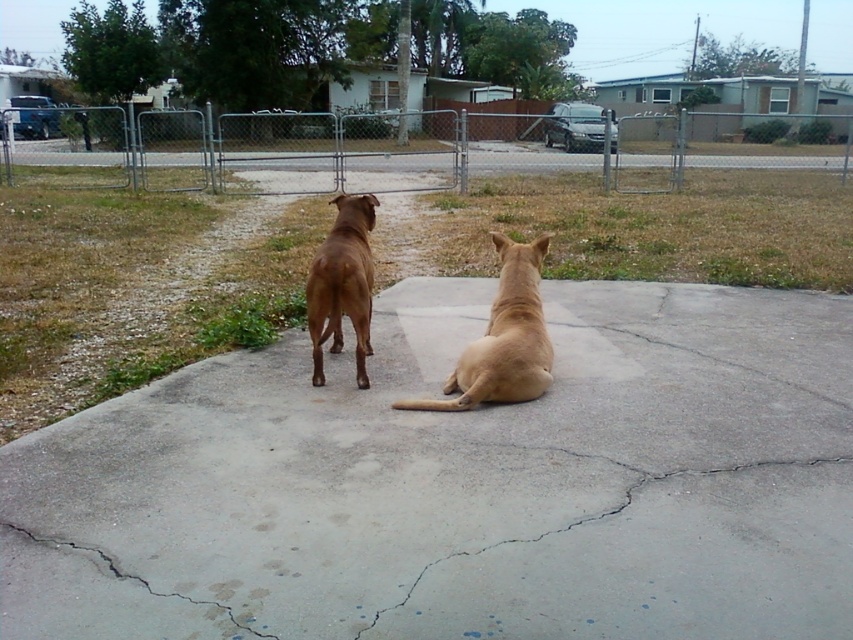
Is light brown fur at center further to camera compared to brown glossy dog at center?

No, light brown fur at center is closer to the viewer.

Does light brown fur at center appear under brown glossy dog at center?

Correct, light brown fur at center is located below brown glossy dog at center.

Does point (503, 301) come farther from viewer compared to point (344, 227)?

No.

The image size is (853, 640). I want to click on light brown fur at center, so click(503, 339).

Can you confirm if gray concrete crack at center is smaller than brown glossy dog at center?

No.

Which is above, gray concrete crack at center or brown glossy dog at center?

Positioned higher is brown glossy dog at center.

At what (x,y) coordinates should I click in order to perform the action: click on gray concrete crack at center. Please return your answer as a coordinate pair (x, y). Looking at the image, I should click on (659, 564).

Where is `gray concrete crack at center`? gray concrete crack at center is located at coordinates (659, 564).

Is gray concrete pavement at center positioned behind gray concrete crack at center?

No, it is not.

Can you confirm if gray concrete pavement at center is taller than gray concrete crack at center?

Yes, gray concrete pavement at center is taller than gray concrete crack at center.

Locate an element on the screen. The height and width of the screenshot is (640, 853). gray concrete pavement at center is located at coordinates (460, 483).